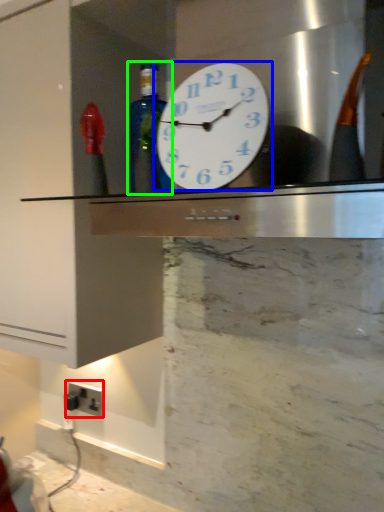
Question: Which object is the farthest from electric outlet (highlighted by a red box)? Choose among these: wall clock (highlighted by a blue box) or bottle (highlighted by a green box).

Choices:
 (A) wall clock
 (B) bottle

Answer: (A)